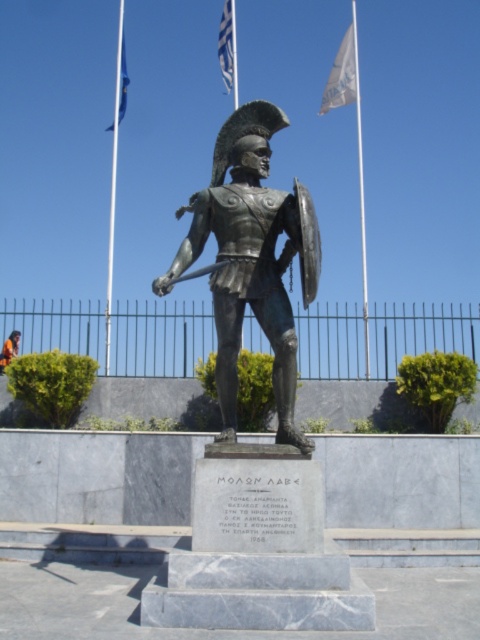
Is white fabric flagpole at upper center above blue fabric flag at upper center?

Actually, white fabric flagpole at upper center is below blue fabric flag at upper center.

Does white fabric flagpole at upper center lie behind blue fabric flag at upper center?

No, it is not.

Who is more distant from viewer, (362,188) or (232,42)?

Positioned behind is point (362,188).

Identify the location of white fabric flagpole at upper center. Image resolution: width=480 pixels, height=640 pixels. (360, 188).

Is white fabric flagpole at upper center closer to the viewer compared to blue fabric flag at upper left?

Yes, white fabric flagpole at upper center is in front of blue fabric flag at upper left.

Between point (360, 134) and point (121, 100), which one is positioned behind?

Point (360, 134)

You are a GUI agent. You are given a task and a screenshot of the screen. Output one action in this format:
    pyautogui.click(x=<x>, y=<y>)
    Task: Click on the white fabric flagpole at upper center
    The height and width of the screenshot is (640, 480).
    Given the screenshot: What is the action you would take?
    pyautogui.click(x=360, y=188)

Does point (296, 339) lie behind point (121, 52)?

No, (296, 339) is closer to viewer.

Locate an element on the screen. The image size is (480, 640). bronze statue at center is located at coordinates (252, 259).

This screenshot has width=480, height=640. Identify the location of bronze statue at center. (252, 259).